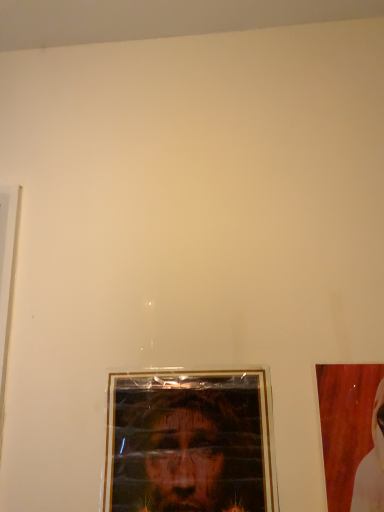
Where is `matte plastic portrait at center`? matte plastic portrait at center is located at coordinates (187, 450).

This screenshot has height=512, width=384. Describe the element at coordinates (187, 450) in the screenshot. I see `matte plastic portrait at center` at that location.

Describe the element at coordinates (345, 424) in the screenshot. I see `wooden picture frame at right` at that location.

Where is `wooden picture frame at right`? wooden picture frame at right is located at coordinates (345, 424).

In order to face wooden picture frame at right, should I rotate leftwards or rightwards?

Rotate your view right by about 28.227°.

The image size is (384, 512). I want to click on matte plastic portrait at center, so click(x=187, y=450).

Which is more to the left, matte plastic portrait at center or wooden picture frame at right?

Positioned to the left is matte plastic portrait at center.

Does matte plastic portrait at center come in front of wooden picture frame at right?

No, it is not.

Is point (144, 508) closer or farther from the camera than point (335, 364)?

Point (144, 508) is closer to the camera than point (335, 364).

From the image's perspective, is matte plastic portrait at center located above or below wooden picture frame at right?

From the image's perspective, matte plastic portrait at center appears below wooden picture frame at right.

From a real-world perspective, which object rests below the other?

From a 3D spatial view, matte plastic portrait at center is below.

Which object is wider, matte plastic portrait at center or wooden picture frame at right?

matte plastic portrait at center.

Is matte plastic portrait at center taller than wooden picture frame at right?

Yes.

Who is bigger, matte plastic portrait at center or wooden picture frame at right?

With larger size is matte plastic portrait at center.

Which is correct: matte plastic portrait at center is inside wooden picture frame at right, or outside of it?

matte plastic portrait at center is not enclosed by wooden picture frame at right.

Are matte plastic portrait at center and wooden picture frame at right beside each other?

No, matte plastic portrait at center is not making contact with wooden picture frame at right.

Is matte plastic portrait at center oriented away from wooden picture frame at right?

No, matte plastic portrait at center's orientation is not away from wooden picture frame at right.

Looking at this image, what's the angular difference between matte plastic portrait at center and wooden picture frame at right's facing directions?

1.12 degrees separate the facing orientations of matte plastic portrait at center and wooden picture frame at right.

Locate an element on the screen. The image size is (384, 512). picture frame in front of the matte plastic portrait at center is located at coordinates [x=345, y=424].

Which is more to the right, wooden picture frame at right or matte plastic portrait at center?

wooden picture frame at right is more to the right.

Which is behind, wooden picture frame at right or matte plastic portrait at center?

matte plastic portrait at center is more distant.

Considering the positions of point (328, 400) and point (166, 436), is point (328, 400) closer or farther from the camera than point (166, 436)?

Point (328, 400).

From the image's perspective, is wooden picture frame at right above or below matte plastic portrait at center?

wooden picture frame at right is situated higher than matte plastic portrait at center in the image.

From a real-world perspective, which object stands above the other?

wooden picture frame at right, from a real-world perspective.

Can you confirm if wooden picture frame at right is wider than matte plastic portrait at center?

In fact, wooden picture frame at right might be narrower than matte plastic portrait at center.

Is wooden picture frame at right taller than matte plastic portrait at center?

Incorrect, the height of wooden picture frame at right is not larger of that of matte plastic portrait at center.

Considering the relative sizes of wooden picture frame at right and matte plastic portrait at center in the image provided, is wooden picture frame at right bigger than matte plastic portrait at center?

Incorrect, wooden picture frame at right is not larger than matte plastic portrait at center.

Choose the correct answer: Is wooden picture frame at right inside matte plastic portrait at center or outside it?

wooden picture frame at right is not enclosed by matte plastic portrait at center.

Is wooden picture frame at right with matte plastic portrait at center?

wooden picture frame at right and matte plastic portrait at center are clearly separated.

Is wooden picture frame at right positioned with its back to matte plastic portrait at center?

wooden picture frame at right does not have its back to matte plastic portrait at center.

How different are the orientations of wooden picture frame at right and matte plastic portrait at center in degrees?

wooden picture frame at right and matte plastic portrait at center are facing 1.12 degrees away from each other.

Locate an element on the screen. This screenshot has height=512, width=384. picture frame in front of the matte plastic portrait at center is located at coordinates (345, 424).

This screenshot has width=384, height=512. I want to click on man on the left of wooden picture frame at right, so click(187, 450).

Locate an element on the screen. The width and height of the screenshot is (384, 512). picture frame in front of the matte plastic portrait at center is located at coordinates (345, 424).